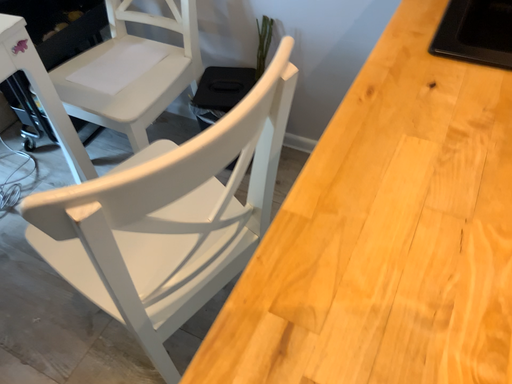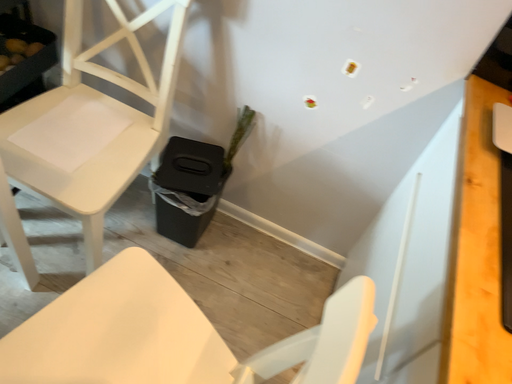
Question: How did the camera likely rotate when shooting the video?

Choices:
 (A) rotated left
 (B) rotated right

Answer: (B)